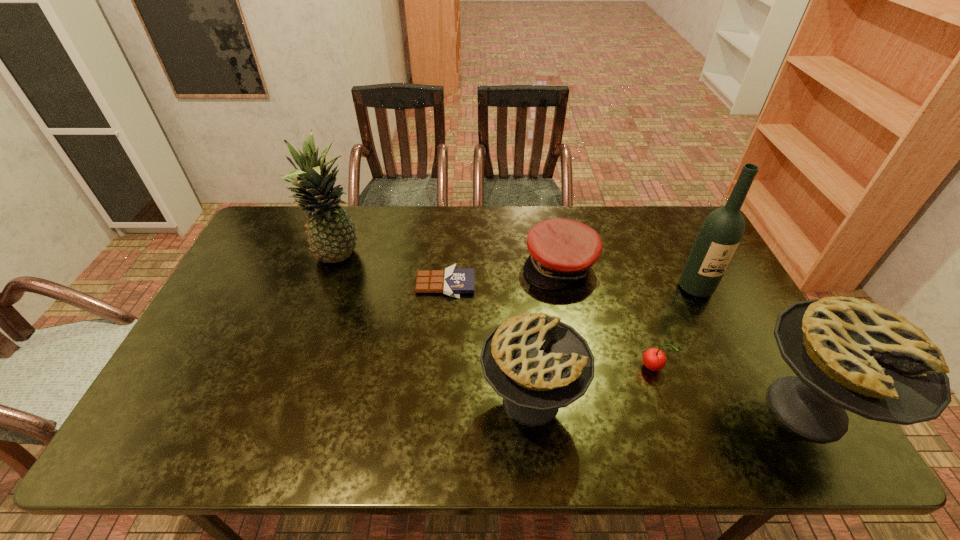
At what (x,y) coordinates should I click in order to perform the action: click on vacant area situated on the cut side of the shorter pie. Please return your answer as a coordinate pair (x, y). Looking at the image, I should click on (636, 401).

What are the coordinates of `vacant space located at the front of the cap where the visor is located` in the screenshot? It's located at 587,407.

The height and width of the screenshot is (540, 960). Find the location of `vacant space located on the left of the pineapple`. vacant space located on the left of the pineapple is located at coordinates (271, 259).

Locate an element on the screen. This screenshot has width=960, height=540. free space located 0.220m on the front of the second object from left to right is located at coordinates (440, 361).

At what (x,y) coordinates should I click in order to perform the action: click on vacant region located on the back of the third object from right to left. Please return your answer as a coordinate pair (x, y). This screenshot has height=540, width=960. Looking at the image, I should click on (620, 274).

Identify the location of blank space located on the labeled side of the wine bottle. (745, 388).

Find the location of a particular element. This screenshot has height=540, width=960. cap at the far edge is located at coordinates (562, 251).

Where is `pineapple that is at the far edge`? This screenshot has width=960, height=540. pineapple that is at the far edge is located at coordinates (331, 234).

Where is `pie situated at the right edge`? The width and height of the screenshot is (960, 540). pie situated at the right edge is located at coordinates (848, 353).

Where is `wine bottle present at the right edge`? Image resolution: width=960 pixels, height=540 pixels. wine bottle present at the right edge is located at coordinates (721, 232).